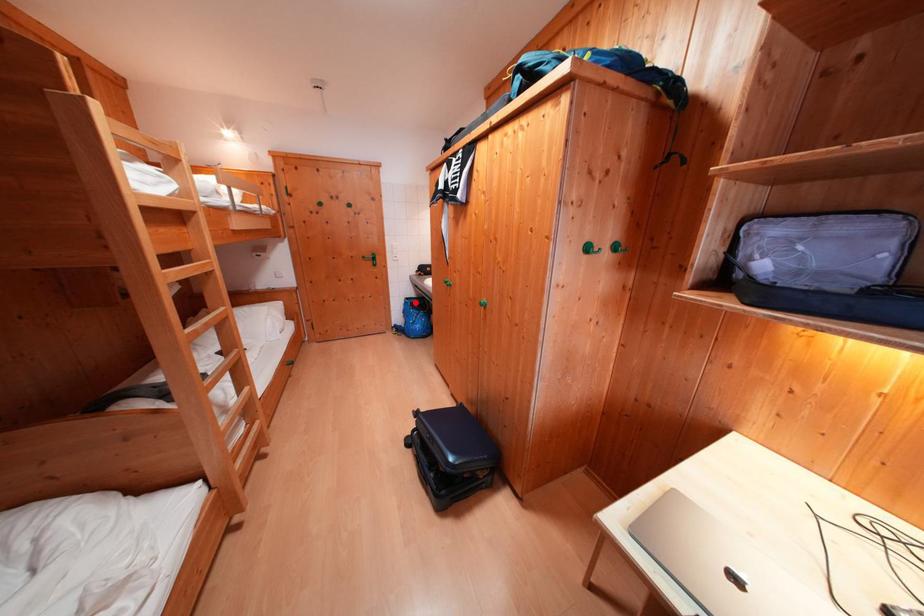
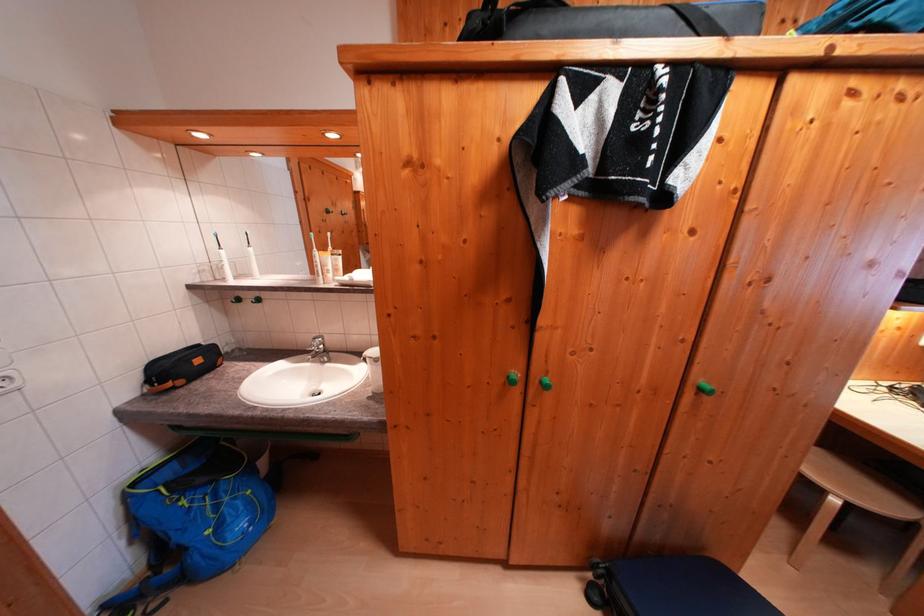
The point at the highlighted location is marked in the first image. Where is the corresponding point in the second image?

(142, 488)